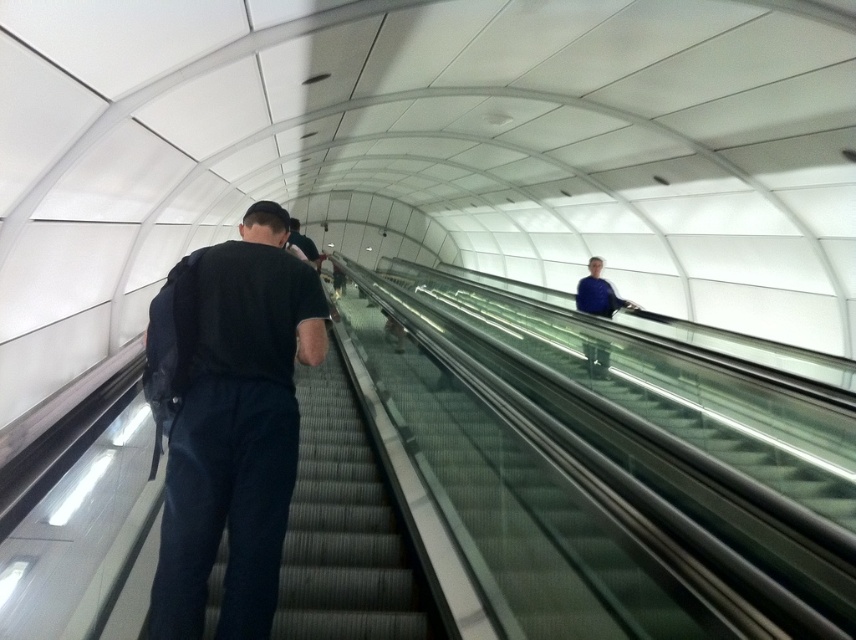
Between black fabric stairs at center and blue fabric jacket at upper center, which one appears on the left side from the viewer's perspective?

black fabric stairs at center

Between point (406, 582) and point (592, 355), which one is positioned behind?

The point (592, 355) is behind.

You are a GUI agent. You are given a task and a screenshot of the screen. Output one action in this format:
    pyautogui.click(x=<x>, y=<y>)
    Task: Click on the black fabric stairs at center
    
    Given the screenshot: What is the action you would take?
    pyautogui.click(x=346, y=529)

Locate an element on the screen. The height and width of the screenshot is (640, 856). black fabric stairs at center is located at coordinates (346, 529).

Which is above, black fabric backpack at left or blue fabric jacket at upper center?

blue fabric jacket at upper center

Is black fabric backpack at left bigger than blue fabric jacket at upper center?

Yes.

Locate an element on the screen. Image resolution: width=856 pixels, height=640 pixels. black fabric backpack at left is located at coordinates (235, 428).

Is black fabric backpack at left closer to camera compared to black fabric stairs at center?

Yes.

Is point (248, 316) more distant than point (305, 460)?

No, (248, 316) is closer to viewer.

Who is more distant from viewer, (181, 442) or (316, 600)?

The point (316, 600) is more distant.

At what (x,y) coordinates should I click in order to perform the action: click on black fabric backpack at left. Please return your answer as a coordinate pair (x, y). Image resolution: width=856 pixels, height=640 pixels. Looking at the image, I should click on (235, 428).